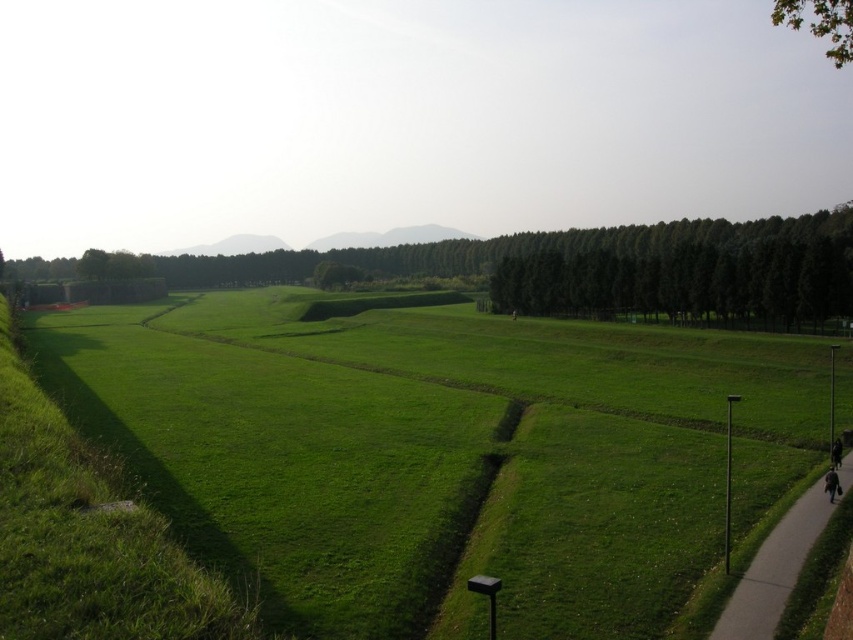
You are standing at the center of the field and see the green leafy tree at upper right and the black fabric person at lower right. Which object is located to the right side of the other?

The green leafy tree at upper right is to the right of the black fabric person at lower right.

You are standing at the center of the grassy field in the image. You see a gray concrete sidewalk at lower right. Where is the point with coordinates [775,570] located?

The point with coordinates [775,570] is located on the gray concrete sidewalk at lower right.